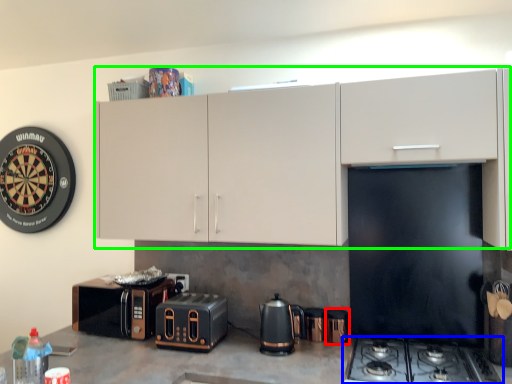
Question: Which object is positioned closest to appliance (highlighted by a red box)? Select from gas stove (highlighted by a blue box) and cabinetry (highlighted by a green box).

Choices:
 (A) gas stove
 (B) cabinetry

Answer: (A)